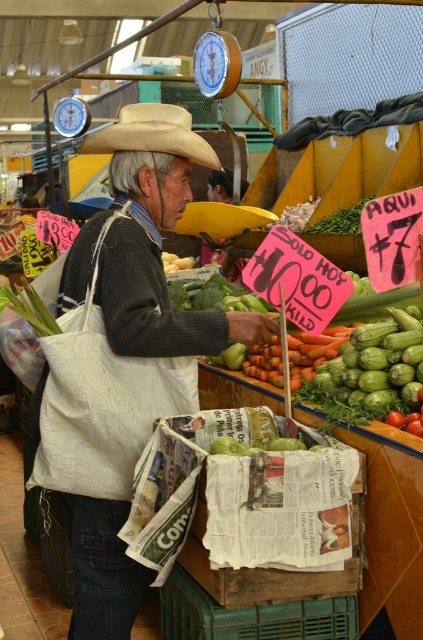
You are a customer at the market and want to pick up the green matte zucchini at center and the light brown felt cowboy hat at center. Which item should you reach for first if you want to grab the one closer to you?

The green matte zucchini at center is closer to the viewer than the light brown felt cowboy hat at center, so you should reach for the green matte zucchini at center first.